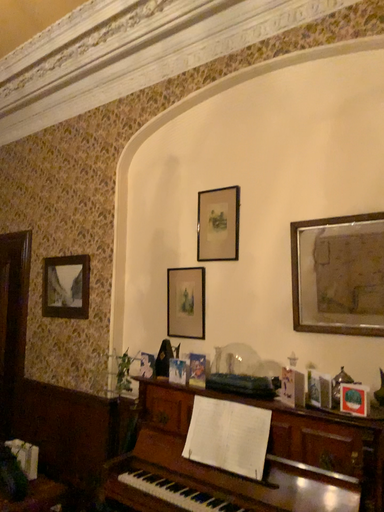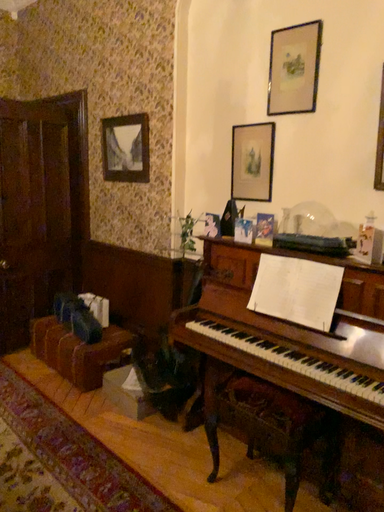
Question: Which way did the camera rotate in the video?

Choices:
 (A) rotated upward
 (B) rotated downward

Answer: (B)